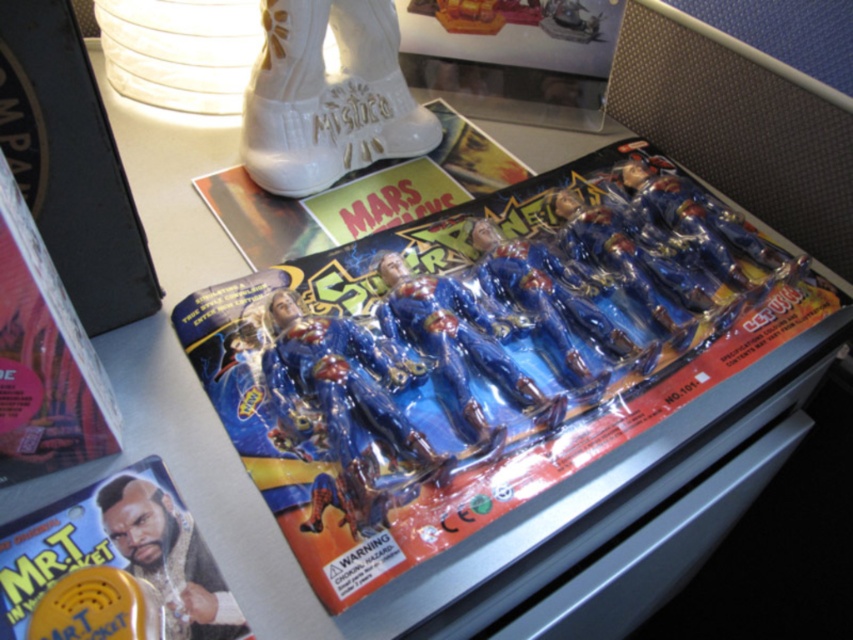
Question: Is blue plastic comic book at center below matte plastic comic book at lower left?

Choices:
 (A) no
 (B) yes

Answer: (A)

Question: Does blue plastic comic book at center have a lesser width compared to matte plastic comic book at lower left?

Choices:
 (A) no
 (B) yes

Answer: (A)

Question: Does blue plastic comic book at center lie behind matte plastic comic book at lower left?

Choices:
 (A) yes
 (B) no

Answer: (A)

Question: Which point is closer to the camera?

Choices:
 (A) (285, 381)
 (B) (136, 572)

Answer: (B)

Question: Which point appears farthest from the camera in this image?

Choices:
 (A) (601, 266)
 (B) (33, 556)

Answer: (A)